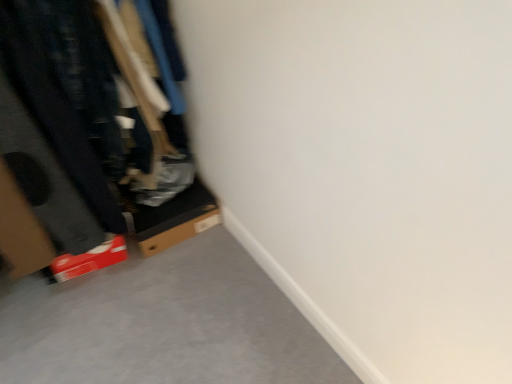
Question: In the image, is cardboard box at left positioned in front of or behind cardboard box at lower left?

Choices:
 (A) behind
 (B) front

Answer: (B)

Question: From a real-world perspective, is cardboard box at left positioned above or below cardboard box at lower left?

Choices:
 (A) below
 (B) above

Answer: (B)

Question: Considering the positions of cardboard box at left and cardboard box at lower left in the image, is cardboard box at left taller or shorter than cardboard box at lower left?

Choices:
 (A) short
 (B) tall

Answer: (B)

Question: Considering the positions of cardboard box at lower left and cardboard box at left in the image, is cardboard box at lower left bigger or smaller than cardboard box at left?

Choices:
 (A) small
 (B) big

Answer: (A)

Question: From the image's perspective, relative to cardboard box at left, is cardboard box at lower left above or below?

Choices:
 (A) below
 (B) above

Answer: (A)

Question: Is cardboard box at lower left taller or shorter than cardboard box at left?

Choices:
 (A) short
 (B) tall

Answer: (A)

Question: Would you say cardboard box at lower left is to the left or to the right of cardboard box at left in the picture?

Choices:
 (A) left
 (B) right

Answer: (B)